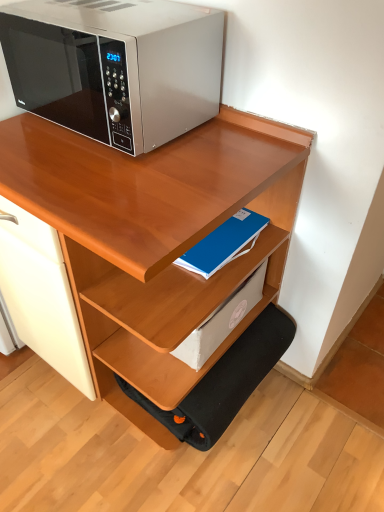
What are the coordinates of `empty space that is ontop of blue matte notebook at center, positioned as the second paperback book in bottom-to-top order (from a real-world perspective)` in the screenshot? It's located at (228, 236).